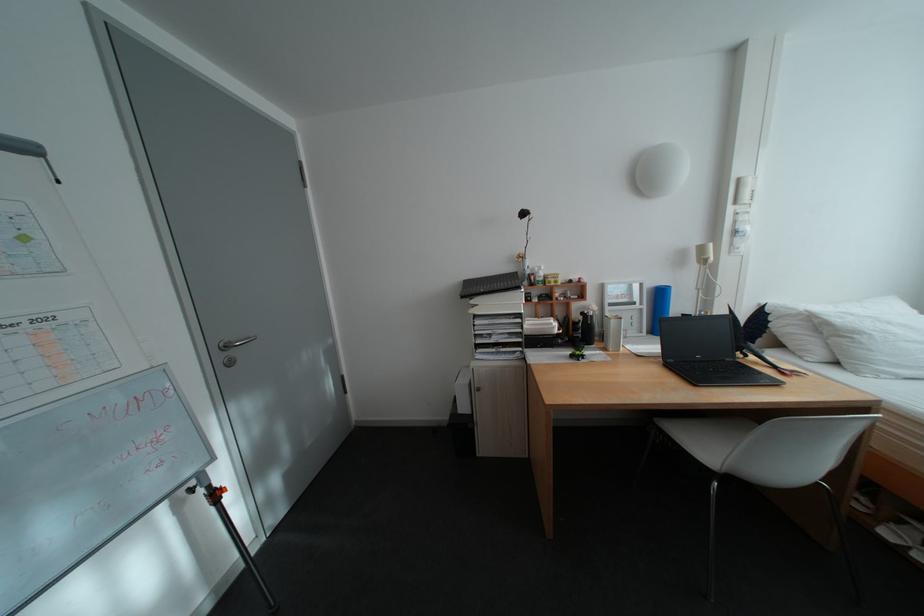
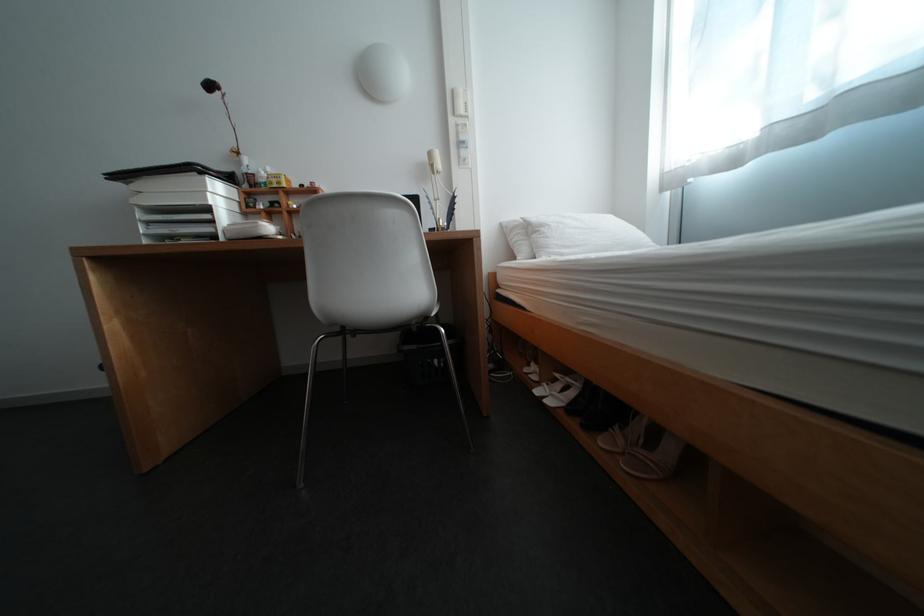
In the second image, find the point that corresponds to pixel 565 325 in the first image.

(270, 224)